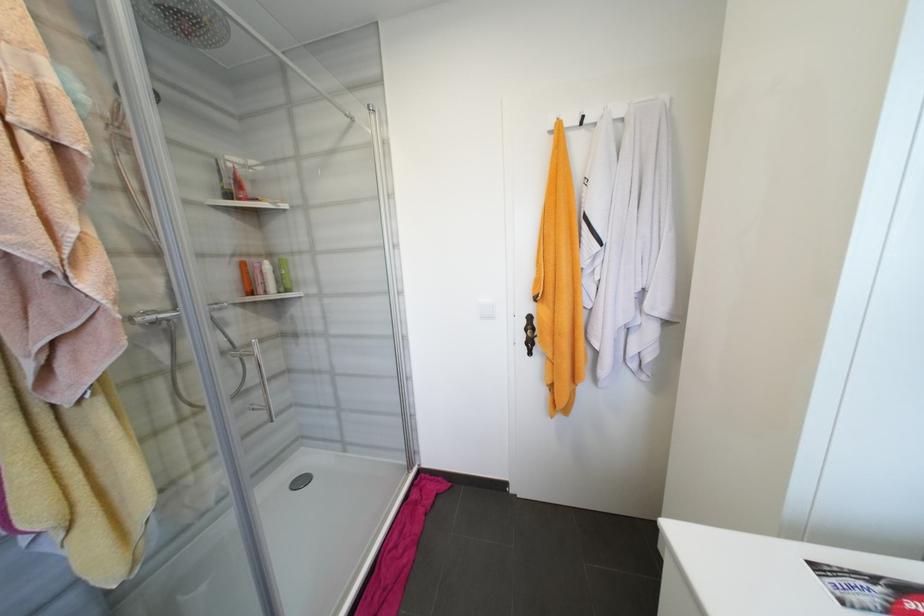
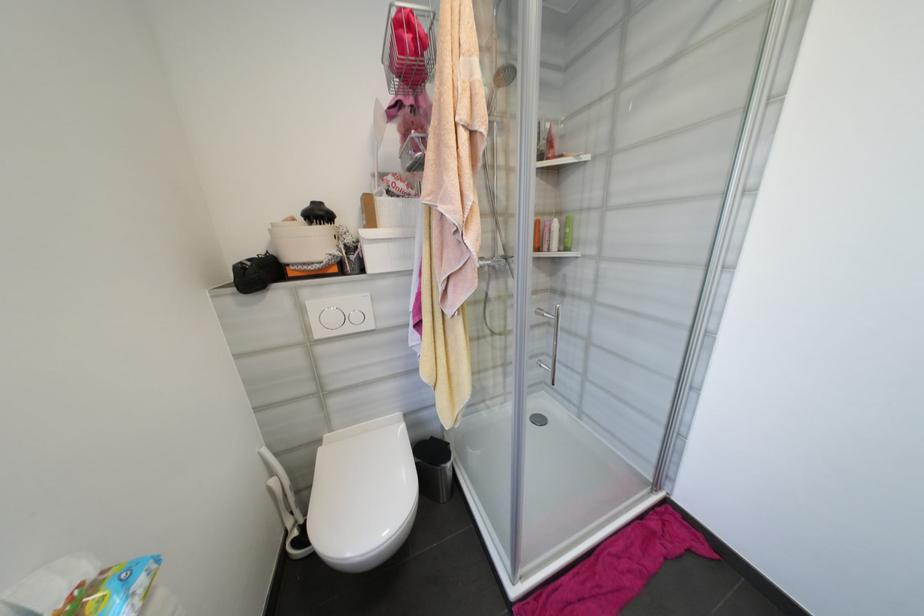
Find the pixel in the second image that matches [309,439] in the first image.

(552, 384)